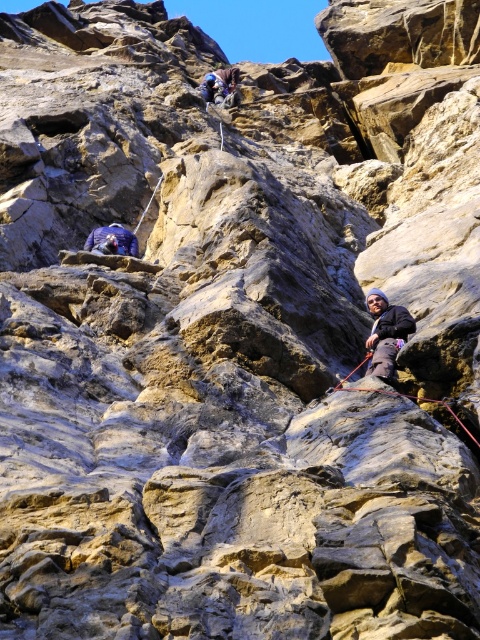
Question: Is dark blue fabric at right below blue fabric jacket at upper center?

Choices:
 (A) no
 (B) yes

Answer: (B)

Question: Which point is farther from the camera taking this photo?

Choices:
 (A) (404, 316)
 (B) (227, 83)

Answer: (B)

Question: Does dark blue fabric at right lie behind blue fabric jacket at upper center?

Choices:
 (A) no
 (B) yes

Answer: (A)

Question: Which point is closer to the camera?

Choices:
 (A) dark blue fabric at right
 (B) blue fabric jacket at upper center

Answer: (A)

Question: Where is dark blue fabric at right located in relation to blue fabric jacket at upper center in the image?

Choices:
 (A) right
 (B) left

Answer: (A)